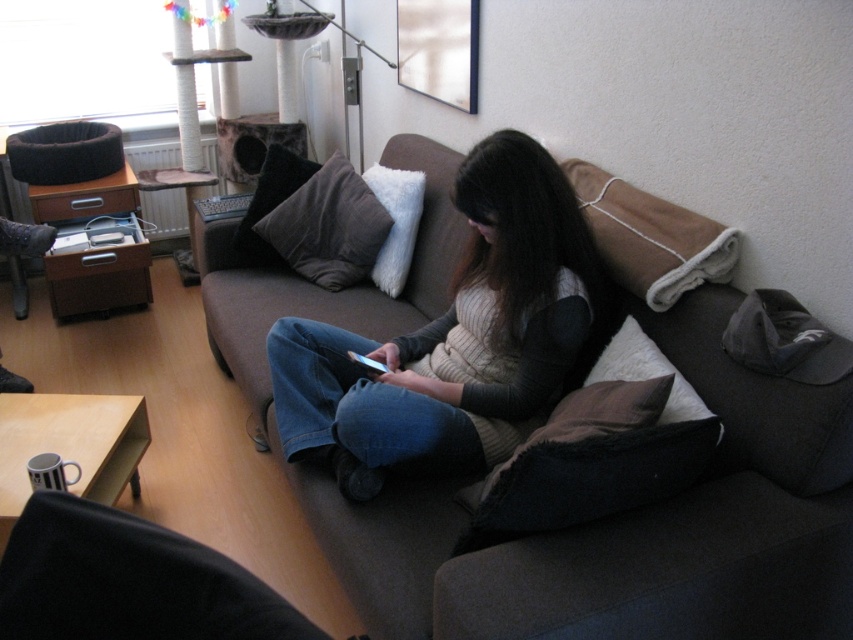
Is knit sweater at center positioned behind brown velvet pillow at center?

That is False.

Measure the distance between knit sweater at center and camera.

knit sweater at center and camera are 5.06 feet apart from each other.

At what (x,y) coordinates should I click in order to perform the action: click on knit sweater at center. Please return your answer as a coordinate pair (x, y). This screenshot has width=853, height=640. Looking at the image, I should click on (454, 339).

Between black fabric at lower left and white fluffy pillow at center, which one has less height?

Standing shorter between the two is black fabric at lower left.

The height and width of the screenshot is (640, 853). Identify the location of black fabric at lower left. (128, 580).

Is point (33, 627) positioned in front of point (396, 196)?

Yes, it is.

Where is `black fabric at lower left`? The image size is (853, 640). black fabric at lower left is located at coordinates (128, 580).

Who is shorter, white fluffy pillow at center or brown soft cushion at center?

With less height is brown soft cushion at center.

Does white fluffy pillow at center appear over brown soft cushion at center?

Actually, white fluffy pillow at center is below brown soft cushion at center.

Who is more distant from viewer, (x=421, y=216) or (x=291, y=156)?

The point (x=291, y=156) is more distant.

You are a GUI agent. You are given a task and a screenshot of the screen. Output one action in this format:
    pyautogui.click(x=<x>, y=<y>)
    Task: Click on the white fluffy pillow at center
    
    Given the screenshot: What is the action you would take?
    pyautogui.click(x=395, y=221)